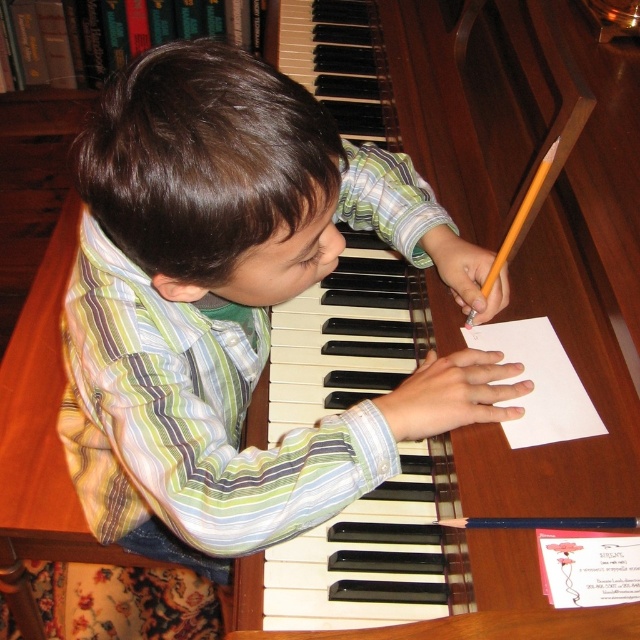
Question: Is striped cotton shirt at center smaller than white paper at lower right?

Choices:
 (A) yes
 (B) no

Answer: (B)

Question: Is striped cotton shirt at center further to the viewer compared to white paper at lower right?

Choices:
 (A) yes
 (B) no

Answer: (B)

Question: Which point appears closest to the camera in this image?

Choices:
 (A) (531, 324)
 (B) (305, 252)

Answer: (B)

Question: Among these objects, which one is farthest from the camera?

Choices:
 (A) wooden piano keys at center
 (B) white paper at lower right

Answer: (B)

Question: Does wooden piano keys at center have a smaller size compared to white paper at lower right?

Choices:
 (A) no
 (B) yes

Answer: (A)

Question: Which object is the closest to the striped cotton shirt at center?

Choices:
 (A) white paper at lower right
 (B) wooden piano keys at center

Answer: (B)